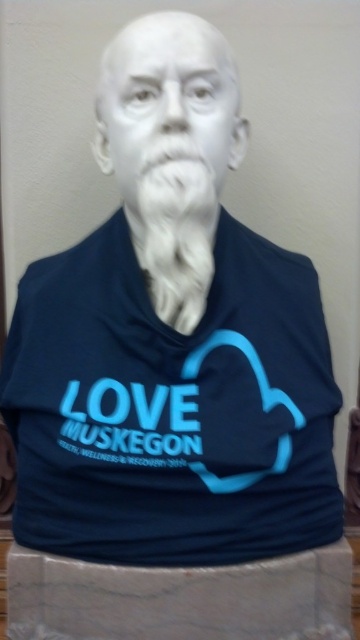
Consider the image. You are standing 5 feet away from the sculpture. Can you reach the point at coordinates point (254, 348) without moving closer?

The point at coordinates point (254, 348) is 4.75 feet away from the camera. Since you are standing 5 feet away from the sculpture, you cannot reach it without moving closer.

You are an art curator examining the sculpture. You notice the white marble bust at center and the white fluffy beard at center. Which object is located higher in the image?

The white marble bust at center is positioned over the white fluffy beard at center, so the white marble bust at center is higher up in the image.

What are the coordinates of the matte blue jersey at center?

The coordinates of the matte blue jersey at center are at point [171,408].